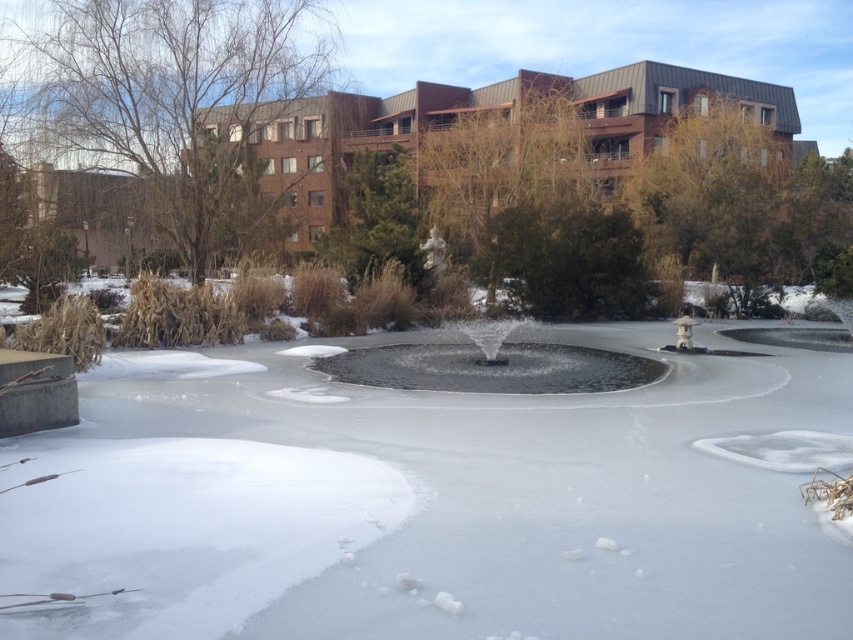
Question: Does bare branches at upper left appear on the right side of green textured tree at center?

Choices:
 (A) no
 (B) yes

Answer: (A)

Question: Which object appears farthest from the camera in this image?

Choices:
 (A) brown textured tree at upper right
 (B) brown textured tree at center
 (C) bare branches at upper left
 (D) green textured tree at center

Answer: (A)

Question: Where is brown textured tree at upper right located in relation to green textured tree at center in the image?

Choices:
 (A) below
 (B) above

Answer: (B)

Question: Which object is farther from the camera taking this photo?

Choices:
 (A) green textured tree at center
 (B) brown textured tree at center

Answer: (B)

Question: Can you confirm if brown textured tree at center is bigger than brown textured tree at upper right?

Choices:
 (A) no
 (B) yes

Answer: (B)

Question: Which is farther from the brown textured tree at upper right?

Choices:
 (A) bare branches at upper left
 (B) brown textured tree at center
 (C) green textured tree at center

Answer: (A)